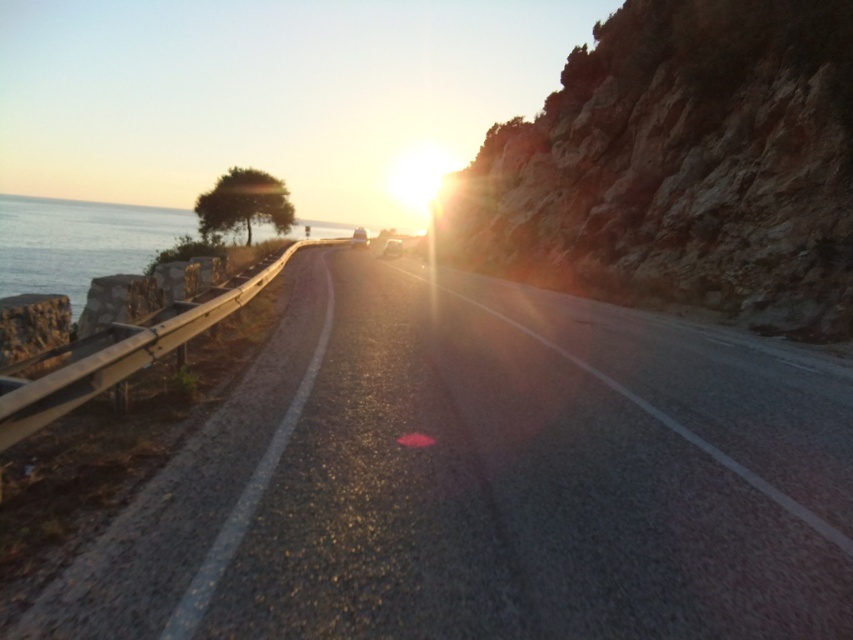
Does asphalt road at center appear on the right side of blue water at left?

Indeed, asphalt road at center is positioned on the right side of blue water at left.

Is point (247, 518) positioned in front of point (82, 220)?

Yes.

Where is `asphalt road at center`? The width and height of the screenshot is (853, 640). asphalt road at center is located at coordinates (483, 481).

Can you confirm if rocky cliff at right is positioned below blue water at left?

Correct, rocky cliff at right is located below blue water at left.

Who is lower down, rocky cliff at right or blue water at left?

rocky cliff at right is below.

Locate an element on the screen. rocky cliff at right is located at coordinates (682, 164).

Image resolution: width=853 pixels, height=640 pixels. What are the coordinates of `rocky cliff at right` in the screenshot? It's located at (682, 164).

Which of these two, asphalt road at center or rocky cliff at right, stands taller?

rocky cliff at right is taller.

Does asphalt road at center have a larger size compared to rocky cliff at right?

Actually, asphalt road at center might be smaller than rocky cliff at right.

Which is in front, point (529, 634) or point (770, 276)?

Point (529, 634) is more forward.

The width and height of the screenshot is (853, 640). Identify the location of asphalt road at center. (483, 481).